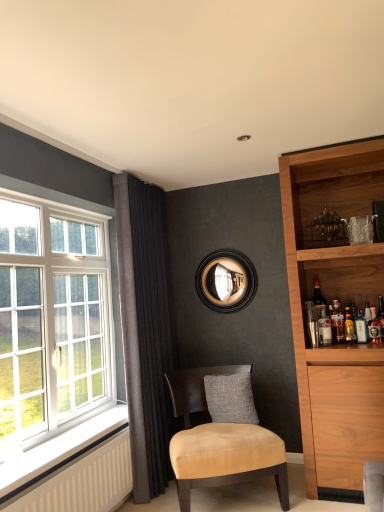
Question: Considering the positions of point (372, 321) and point (254, 430), is point (372, 321) closer or farther from the camera than point (254, 430)?

Choices:
 (A) closer
 (B) farther

Answer: (B)

Question: Looking at the image, does translucent glass bottle at right, placed as the first beverage when sorted from right to left, seem bigger or smaller compared to suede beige chair at center?

Choices:
 (A) small
 (B) big

Answer: (A)

Question: Considering the real-world distances, which object is closest to the white glass window at left?

Choices:
 (A) translucent glass bottle at right, which ranks as the 3th beverage in left-to-right order
 (B) gray fabric pillow at center
 (C) black wood mirror at upper center
 (D) translucent glass bottle at upper right, marked as the 2th beverage in a left-to-right arrangement
 (E) translucent glass bottle at right, which appears as the 1th bottle when viewed from the right

Answer: (B)

Question: Which is farther from the suede beige chair at center?

Choices:
 (A) black wood mirror at upper center
 (B) translucent glass bottle at right, placed as the first beverage when sorted from right to left
 (C) white textured radiator at lower left
 (D) white glass window at left
 (E) translucent glass bottle at upper right, marked as the 2th beverage in a left-to-right arrangement

Answer: (B)